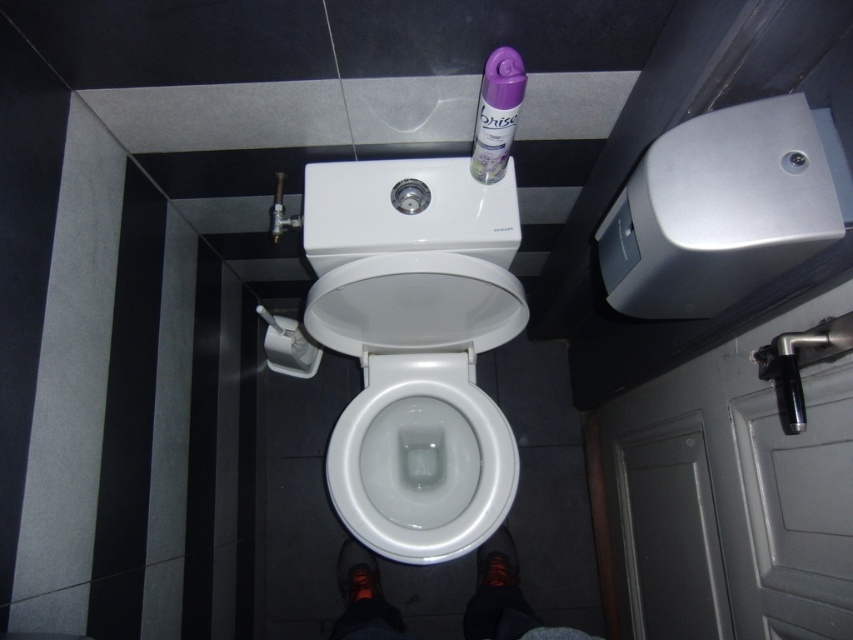
You are a home inspector assessing bathroom fixtures. You need to determine if the purple plastic spray can at upper center can be placed on top of the white glossy toilet bowl at center without exceeding its height. Can it fit?

The white glossy toilet bowl at center is taller than the purple plastic spray can at upper center. Since the spray can is shorter, it can be placed on top of the toilet bowl without exceeding its height.

You are a bathroom designer planning to replace the white glossy toilet bowl at center with a new model. The new toilet must be narrower than the current one. Can the purple plastic spray can at upper center still fit in its current position if the new toilet is installed?

The white glossy toilet bowl at center is currently wider than the purple plastic spray can at upper center. If the new toilet is narrower, there will be more space, so the purple plastic spray can at upper center can still fit in its current position.

You are a delivery person who needs to place a small package on the bathroom counter. The package is the size of the purple plastic spray can at upper center. Can you fit it next to the white glossy toilet bowl at center without moving the bowl?

The white glossy toilet bowl at center is bigger than the purple plastic spray can at upper center. Since the package is the same size as the spray can, it might be challenging to fit it next to the larger toilet bowl without moving the bowl, as there may not be enough space.